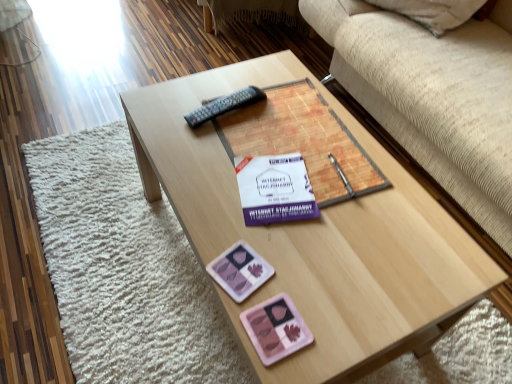
Find the location of `vacant area that lies between white paper at center and pink plastic at lower center, which is the second currency in bottom-to-top order`. vacant area that lies between white paper at center and pink plastic at lower center, which is the second currency in bottom-to-top order is located at coordinates (249, 235).